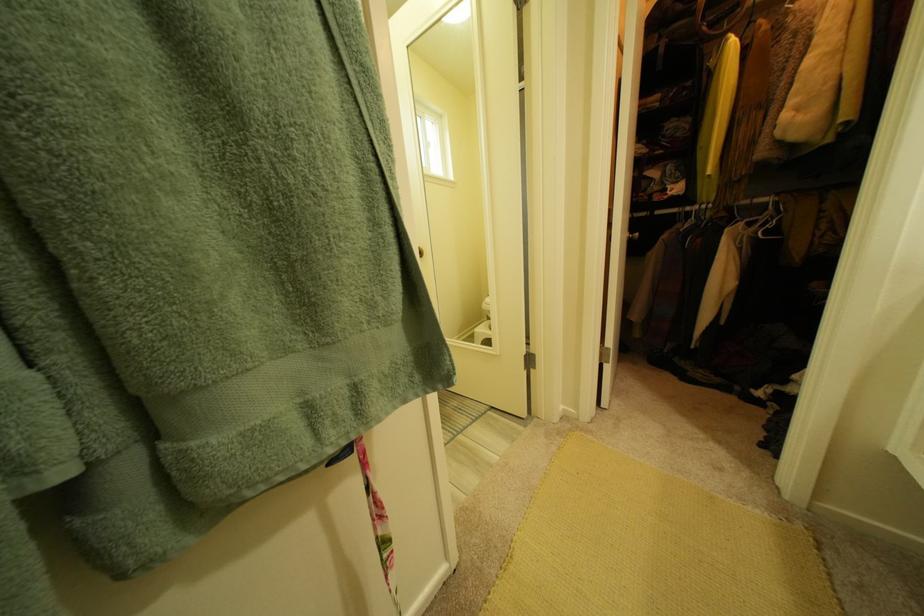
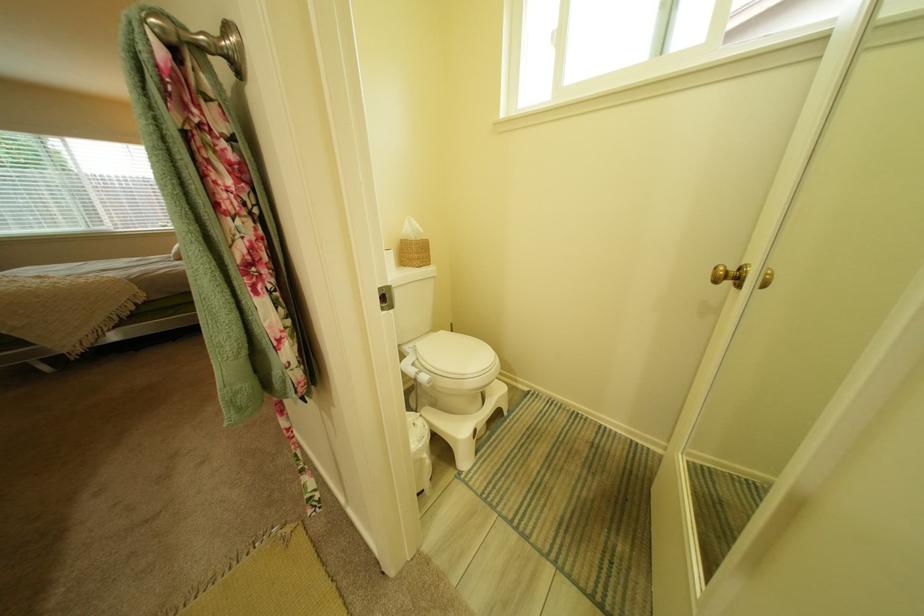
The first image is from the beginning of the video and the second image is from the end. How did the camera likely rotate when shooting the video?

The rotation direction of the camera is left-down.